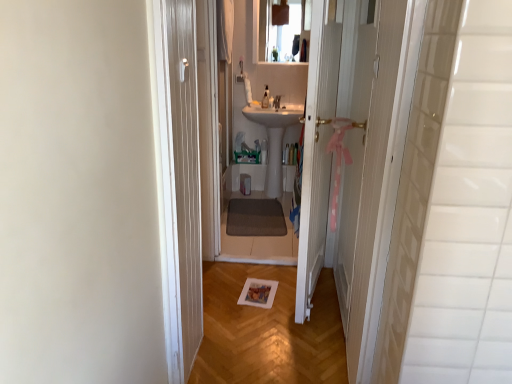
Where is `free space to the left of pink ribbon at right`? free space to the left of pink ribbon at right is located at coordinates (271, 301).